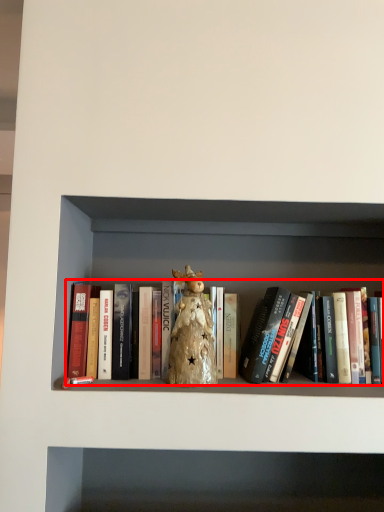
Question: Considering the relative positions of book (annotated by the red box) and toy in the image provided, where is book (annotated by the red box) located with respect to the staircase?

Choices:
 (A) right
 (B) left

Answer: (A)